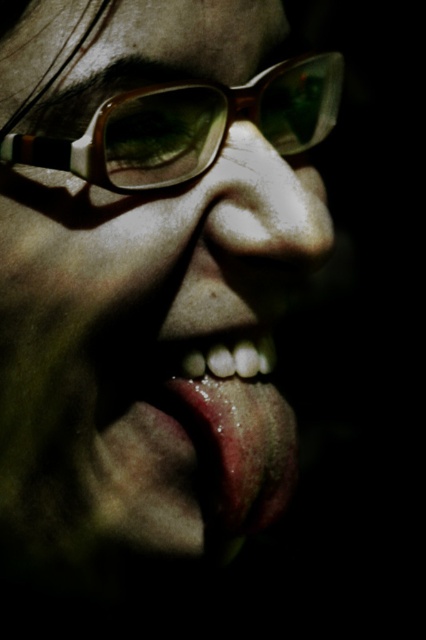
You are a makeup artist preparing for a photoshoot. You need to apply lipstick to the shiny pink lips at center, but you want to ensure it doesn t smudge onto the smooth skin nose at center. Based on the image, where should you apply the lipstick relative to the nose?

The shiny pink lips at center are below the smooth skin nose at center, so you should apply the lipstick below the nose to avoid smudging onto the nose.

You are a photographer adjusting the lighting for a close portrait. You notice two pairs of glasses on the subject, a matte plastic glasses at upper center and a matte brown glasses at upper center. Which glasses would cast a larger reflection under the current lighting?

The matte plastic glasses at upper center would cast a larger reflection under the current lighting because it is larger in size than the matte brown glasses at upper center.

You are a photographer adjusting the focus on your camera. You have two points in the image, point 1 at coordinates point (221, 358) and point 2 at coordinates point (258, 488). Which point should you focus on to ensure the subject is sharp in the foreground?

You should focus on point (221, 358) because it is closer to the camera than point (258, 488), making it the foreground element.